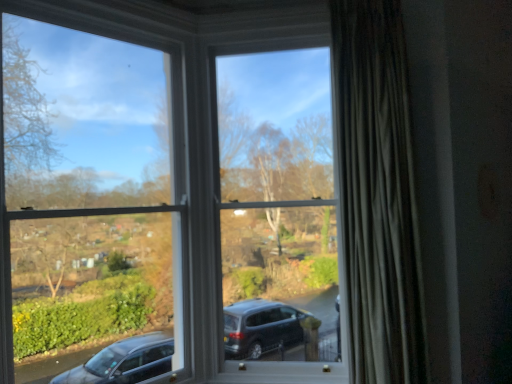
Question: Is white plastic window frame at upper left, which is the 2th window frame in right-to-left order, taller or shorter than white plastic window frame at center, which appears as the 2th window frame when viewed from the left?

Choices:
 (A) tall
 (B) short

Answer: (A)

Question: Considering the positions of white plastic window frame at upper left, which is the 2th window frame in right-to-left order, and white plastic window frame at center, the first window frame viewed from the right, in the image, is white plastic window frame at upper left, which is the 2th window frame in right-to-left order, bigger or smaller than white plastic window frame at center, the first window frame viewed from the right,?

Choices:
 (A) small
 (B) big

Answer: (A)

Question: Estimate the real-world distances between objects in this image. Which object is farther from the white plastic window frame at upper left, which is the 2th window frame in right-to-left order?

Choices:
 (A) white plastic window frame at center, which appears as the 2th window frame when viewed from the left
 (B) silky gray curtain at right

Answer: (B)

Question: Which is farther from the white plastic window frame at upper left, which is counted as the first window frame, starting from the left?

Choices:
 (A) silky gray curtain at right
 (B) white plastic window frame at center, which appears as the 2th window frame when viewed from the left

Answer: (A)